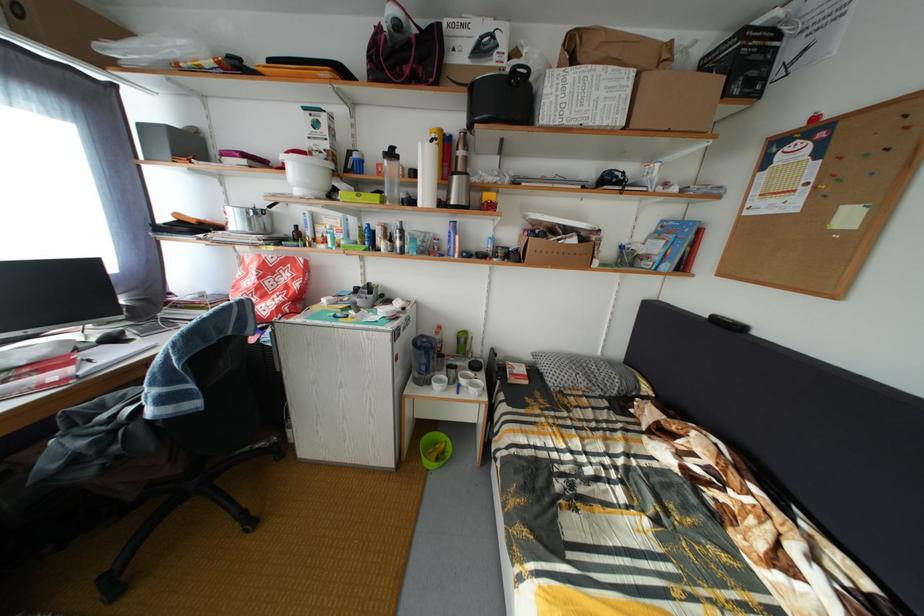
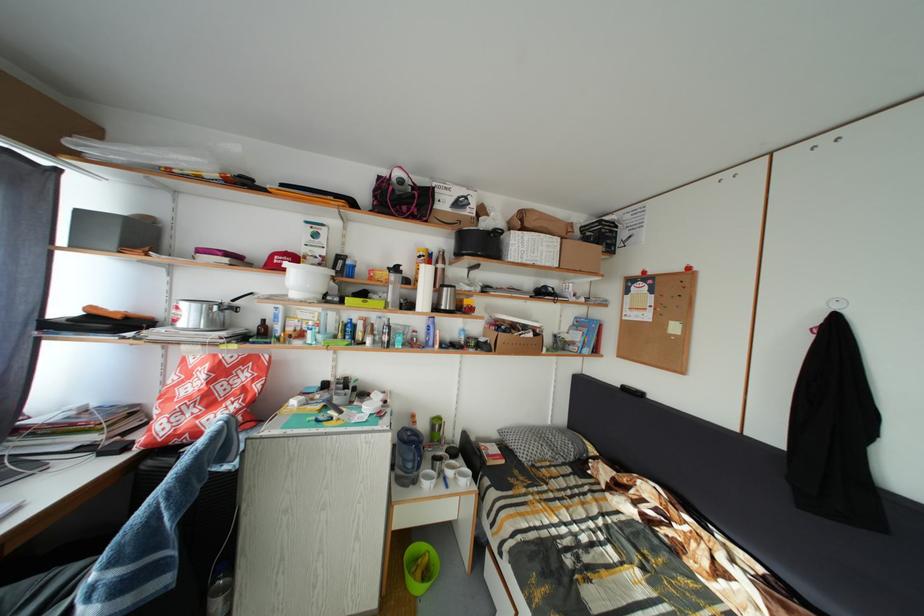
Find the pixel in the second image that matches (x=452, y=453) in the first image.

(435, 565)